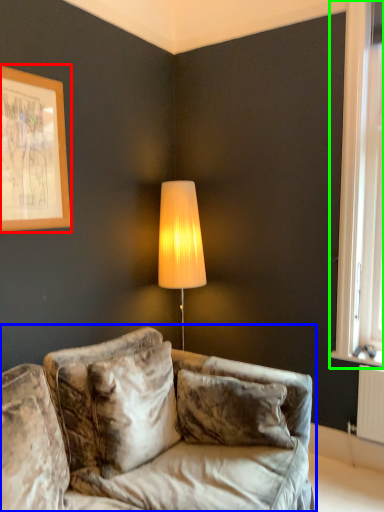
Question: Based on their relative distances, which object is farther from picture frame (highlighted by a red box)? Choose from studio couch (highlighted by a blue box) and window (highlighted by a green box).

Choices:
 (A) studio couch
 (B) window

Answer: (B)